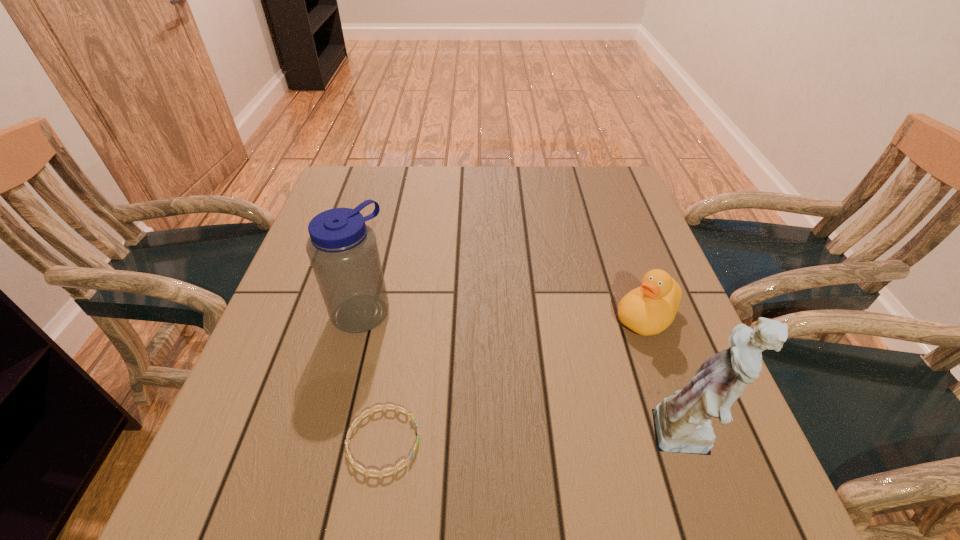
In the image, there is a desktop. Where is `vacant space at the near left corner`? This screenshot has width=960, height=540. vacant space at the near left corner is located at coordinates (230, 416).

Find the location of a particular element. The width and height of the screenshot is (960, 540). vacant space at the far right corner of the desktop is located at coordinates (573, 170).

Where is `free space between the water bottle and the duck`? free space between the water bottle and the duck is located at coordinates (504, 314).

You are a GUI agent. You are given a task and a screenshot of the screen. Output one action in this format:
    pyautogui.click(x=<x>, y=<y>)
    Task: Click on the free space between the second tallest object and the tallest object
    
    Given the screenshot: What is the action you would take?
    pyautogui.click(x=526, y=375)

The width and height of the screenshot is (960, 540). In order to click on vacant space that's between the water bottle and the tallest object in this screenshot , I will do `click(526, 375)`.

Locate an element on the screen. free spot between the shortest object and the third shortest object is located at coordinates (372, 376).

You are a GUI agent. You are given a task and a screenshot of the screen. Output one action in this format:
    pyautogui.click(x=<x>, y=<y>)
    Task: Click on the free area in between the tallest object and the water bottle
    This screenshot has width=960, height=540.
    Given the screenshot: What is the action you would take?
    (x=526, y=375)

Identify the location of free spot between the figurine and the shortest object. (537, 440).

The image size is (960, 540). Identify the location of empty location between the duck and the shortest object. (515, 379).

You are a GUI agent. You are given a task and a screenshot of the screen. Output one action in this format:
    pyautogui.click(x=<x>, y=<y>)
    Task: Click on the free space between the tallest object and the second tallest object
    Image resolution: width=960 pixels, height=540 pixels.
    Given the screenshot: What is the action you would take?
    pyautogui.click(x=526, y=375)